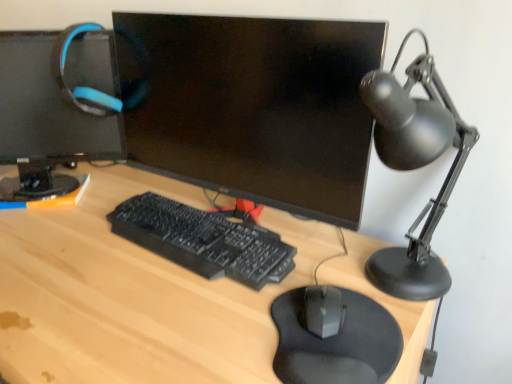
At what (x,y) coordinates should I click in order to perform the action: click on blank space to the left of black matte mouse at center. Please return your answer as a coordinate pair (x, y). Looking at the image, I should click on (207, 318).